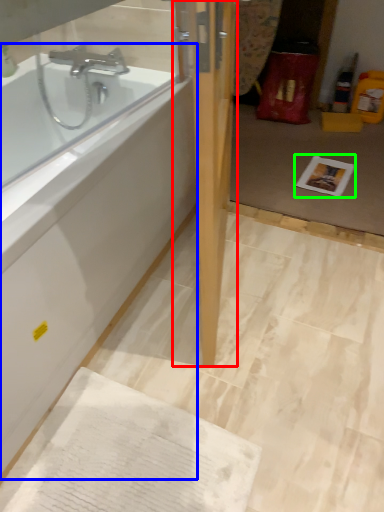
Question: Based on their relative distances, which object is farther from door (highlighted by a red box)? Choose from bathtub (highlighted by a blue box) and copy (highlighted by a green box).

Choices:
 (A) bathtub
 (B) copy

Answer: (B)